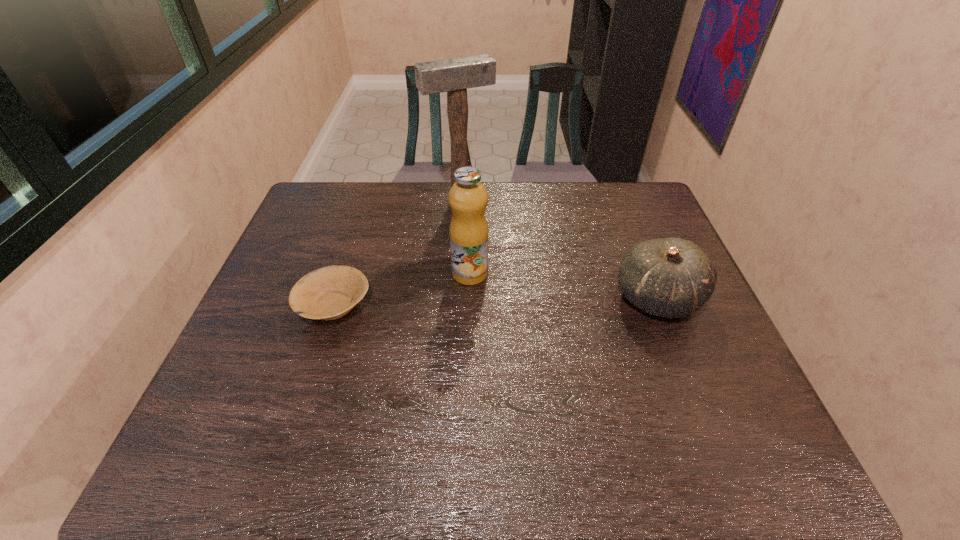
At what (x,y) coordinates should I click in order to perform the action: click on vacant space located 0.260m on the striking surface of the tallest object. Please return your answer as a coordinate pair (x, y). The image size is (960, 540). Looking at the image, I should click on point(504,261).

Locate an element on the screen. free spot located 0.280m on the striking surface of the tallest object is located at coordinates (507, 266).

Locate an element on the screen. vacant space situated on the front label of the second tallest object is located at coordinates (612, 332).

At what (x,y) coordinates should I click in order to perform the action: click on free space located 0.210m on the front label of the second tallest object. Please return your answer as a coordinate pair (x, y). The width and height of the screenshot is (960, 540). Looking at the image, I should click on (x=556, y=309).

Identify the location of blank space located on the front label of the second tallest object. The height and width of the screenshot is (540, 960). (518, 293).

You are a GUI agent. You are given a task and a screenshot of the screen. Output one action in this format:
    pyautogui.click(x=<x>, y=<y>)
    Task: Click on the object present at the far edge
    Image resolution: width=960 pixels, height=540 pixels.
    Given the screenshot: What is the action you would take?
    pyautogui.click(x=454, y=76)

Locate an element on the screen. object positioned at the left edge is located at coordinates (328, 293).

I want to click on object at the right edge, so click(671, 277).

This screenshot has width=960, height=540. I want to click on vacant region at the far edge, so click(x=400, y=181).

Image resolution: width=960 pixels, height=540 pixels. In the image, there is a desktop. Identify the location of vacant space at the near edge. (560, 410).